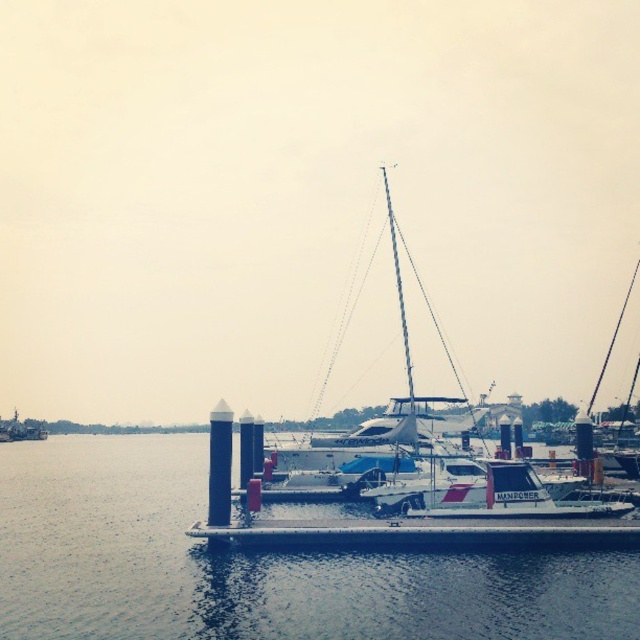
Based on the photo, you are a boat operator who needs to navigate a 100 feet long cargo ship through the marina. The cargo ship requires a minimum of 150 feet of clearance between obstacles. Based on the image, is there enough space between the clear water at center and the metallic gray boat at lower left for the cargo ship to pass safely?

The clear water at center is 197.25 feet from the metallic gray boat at lower left. Since the cargo ship requires 150 feet of clearance, there is sufficient space for it to pass safely between them.

You are standing on the pier and want to take a photo of the metallic gray boat at lower left and the clear water at center. Which object should you focus on first if you want to capture both in one frame without moving your camera?

You should focus on the metallic gray boat at lower left first because it is closer to you than the clear water at center, allowing both to be in focus within the same frame.

You are standing on the pier and looking at the clear water at center and the metallic gray boat at lower left. Which object is closer to the surface of the water?

The clear water at center is located above the metallic gray boat at lower left, so the clear water at center is closer to the surface of the water.